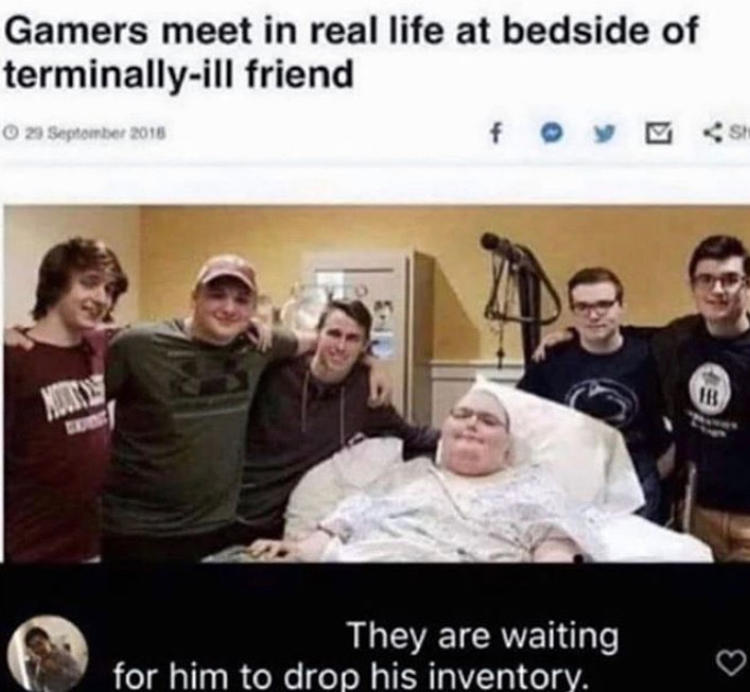
You are a GUI agent. You are given a task and a screenshot of the screen. Output one action in this format:
    pyautogui.click(x=<x>, y=<y>)
    Task: Click on the hospital bed
    The height and width of the screenshot is (692, 750).
    Given the screenshot: What is the action you would take?
    pyautogui.click(x=630, y=529)